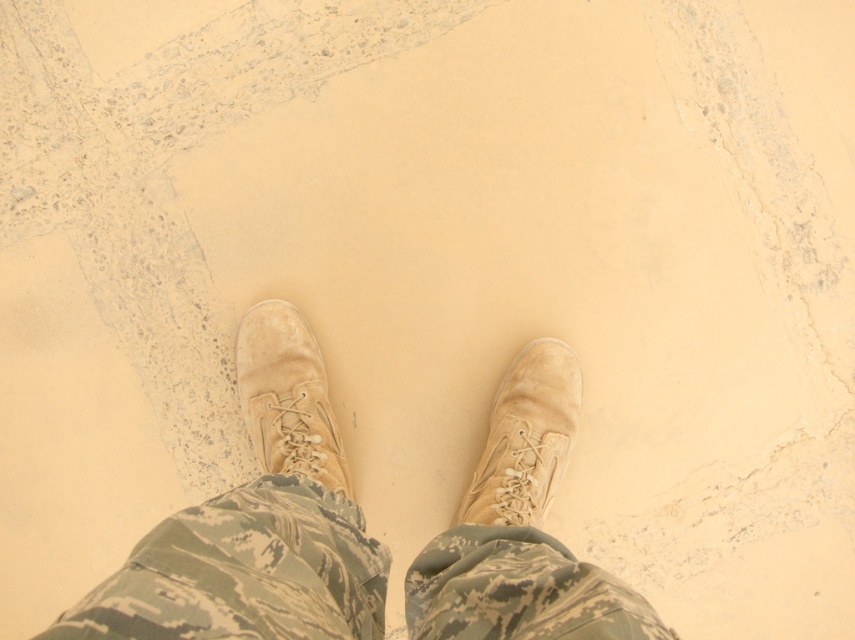
Question: Is tan suede boots at center positioned at the back of tan suede boot at center?

Choices:
 (A) yes
 (B) no

Answer: (B)

Question: Is tan suede boots at center closer to the viewer compared to tan suede boot at center?

Choices:
 (A) no
 (B) yes

Answer: (B)

Question: Which point appears farthest from the camera in this image?

Choices:
 (A) (558, 387)
 (B) (503, 492)
 (C) (315, 467)

Answer: (A)

Question: Which object is the closest to the suede boot at center?

Choices:
 (A) tan suede boot at center
 (B) tan suede boots at center

Answer: (A)

Question: Observing the image, what is the correct spatial positioning of tan suede boots at center in reference to suede boot at center?

Choices:
 (A) below
 (B) above

Answer: (A)

Question: Which object is the closest to the tan suede boot at center?

Choices:
 (A) suede boot at center
 (B) tan suede boots at center

Answer: (A)